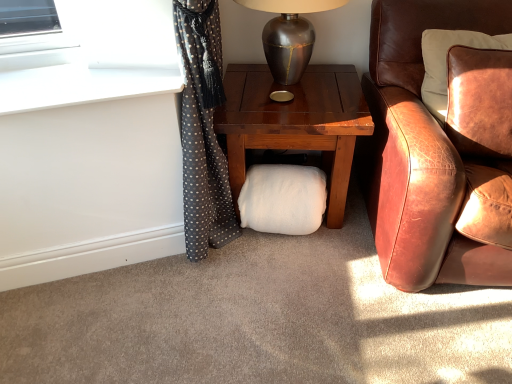
Question: Choose the correct answer: Is brown leather chair at right inside metallic silver table lamp at upper center or outside it?

Choices:
 (A) inside
 (B) outside

Answer: (B)

Question: From a real-world perspective, relative to metallic silver table lamp at upper center, is brown leather chair at right vertically above or below?

Choices:
 (A) above
 (B) below

Answer: (B)

Question: Estimate the real-world distances between objects in this image. Which object is farther from the metallic silver table lamp at upper center?

Choices:
 (A) brown leather chair at right
 (B) leather pillow at right
 (C) white smooth window sill at upper left
 (D) wooden nightstand at center
 (E) white fluffy pillow at center

Answer: (C)

Question: Considering the real-world distances, which object is farthest from the leather pillow at right?

Choices:
 (A) wooden nightstand at center
 (B) brown leather chair at right
 (C) metallic silver table lamp at upper center
 (D) white smooth window sill at upper left
 (E) white fluffy pillow at center

Answer: (D)